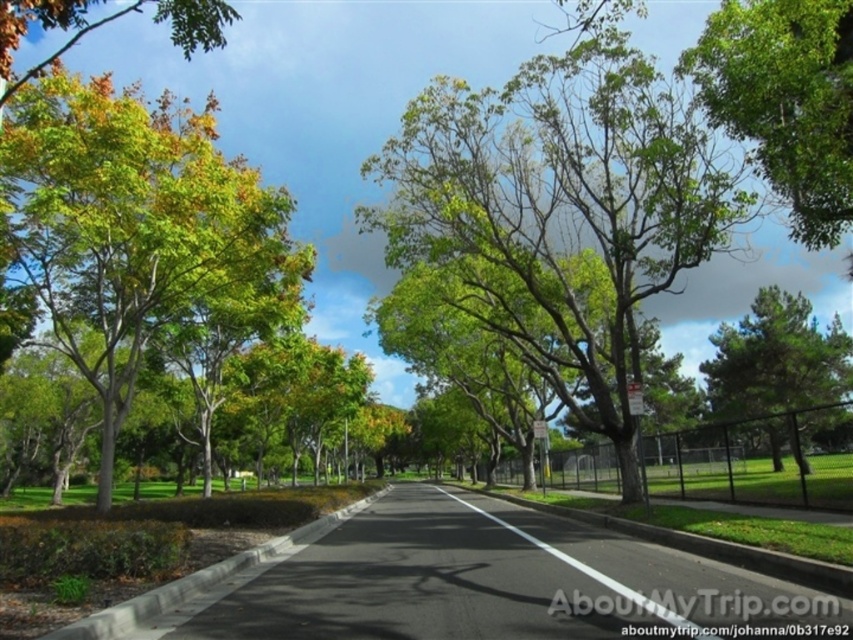
Question: Does green leafy tree at left appear over green leafy tree at upper left?

Choices:
 (A) yes
 (B) no

Answer: (B)

Question: Which point appears farthest from the camera in this image?

Choices:
 (A) (115, 266)
 (B) (773, 321)
 (C) (556, 88)

Answer: (B)

Question: Does green leafy tree at left come in front of green leafy tree at upper left?

Choices:
 (A) no
 (B) yes

Answer: (A)

Question: Can you confirm if green leafy tree at center is positioned to the right of green leafy tree at left?

Choices:
 (A) yes
 (B) no

Answer: (A)

Question: Which object is farther from the camera taking this photo?

Choices:
 (A) green textured pine tree at right
 (B) green leafy tree at center
 (C) green leafy tree at upper right
 (D) green leafy tree at left

Answer: (A)

Question: Which point is closer to the camera taking this photo?

Choices:
 (A) tap(770, 176)
 (B) tap(796, 369)

Answer: (A)